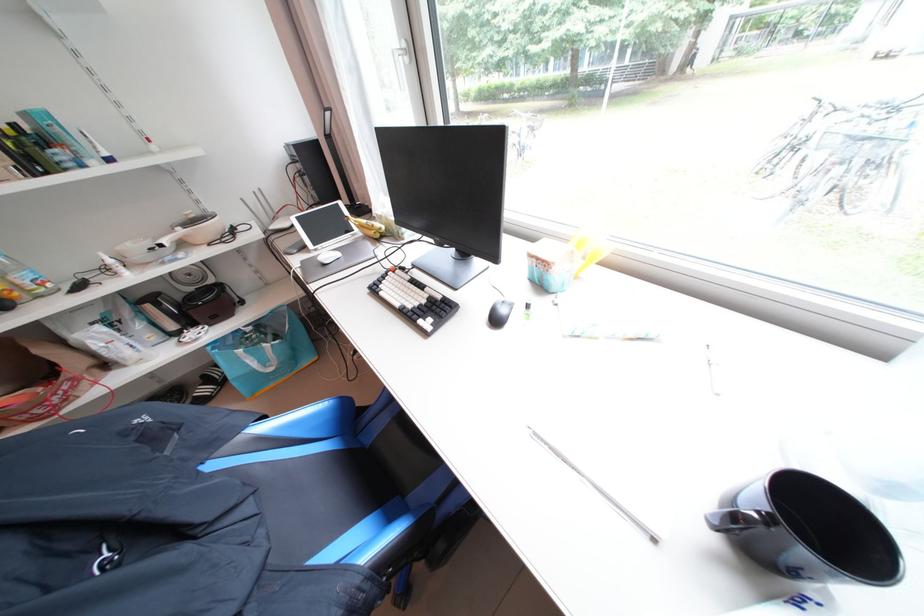
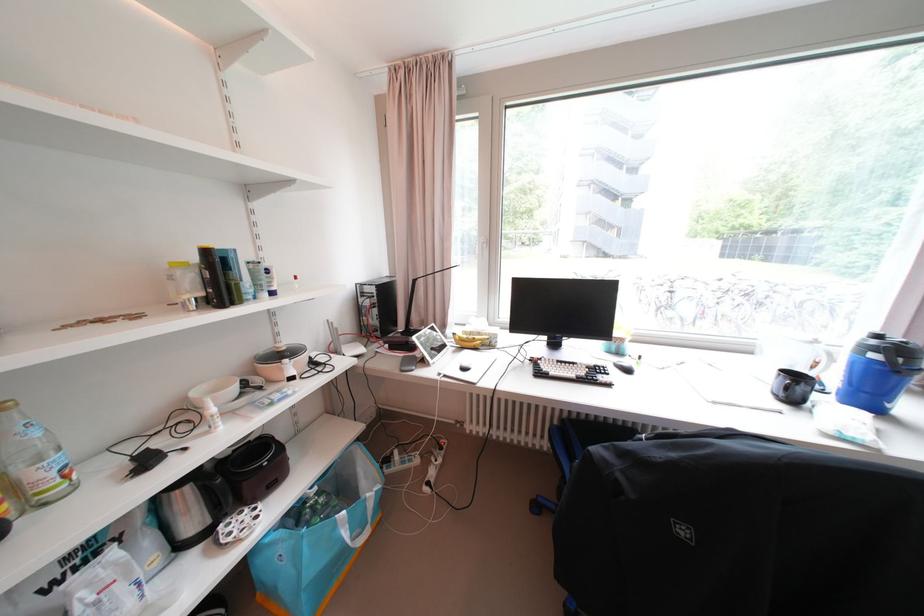
Where in the second image is the point corresponding to [262,363] from the first image?

(354, 537)